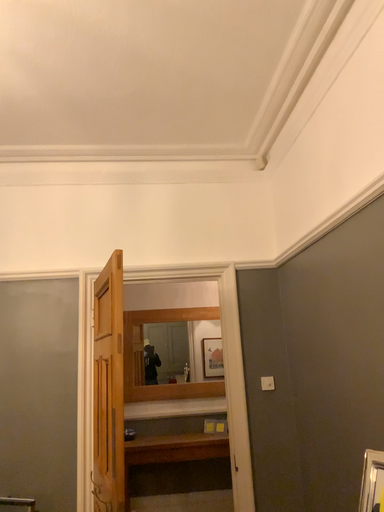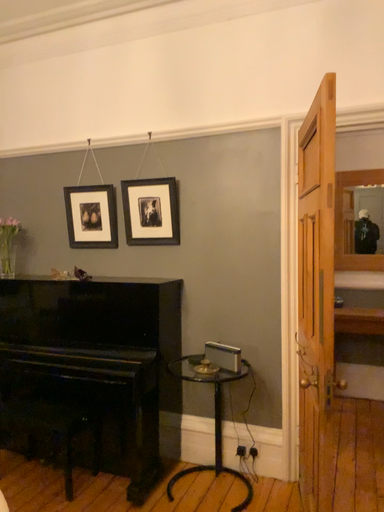
Question: How did the camera likely rotate when shooting the video?

Choices:
 (A) rotated downward
 (B) rotated upward

Answer: (A)